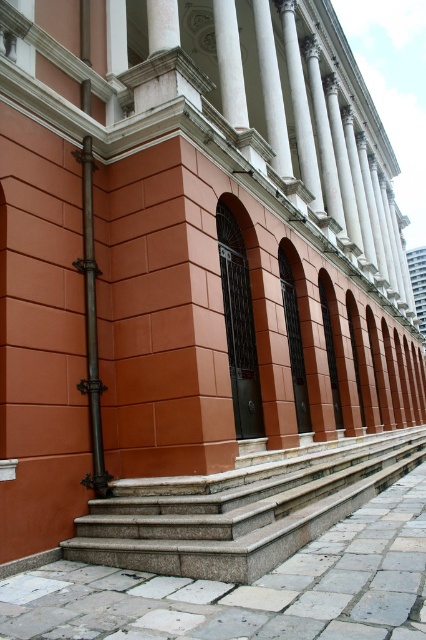
Looking at this image, you are standing at the base of the granite steps at lower center and want to take a photo of the grand building. The camera is placed 4.20 meters away from the steps. Is the camera positioned to the left or right of the steps?

The camera is positioned 4.20 meters away from the granite steps at lower center, but the direction isn t specified in the description. Without additional information about the camera s left or right placement relative to the steps, it s impossible to determine the exact side.

You are standing on the granite steps at lower center and want to reach the white marble pillar at upper center. Which direction should you move to get there?

You should move upward towards the white marble pillar at upper center since it is located behind and above the granite steps at lower center.

You are an architect analyzing the building structure. You need to determine which object is shorter between the granite steps at lower center and the white marble pillar at upper center. Based on the provided scene description, which one is shorter?

The granite steps at lower center has a lesser height compared to the white marble pillar at upper center, so the granite steps at lower center is shorter.